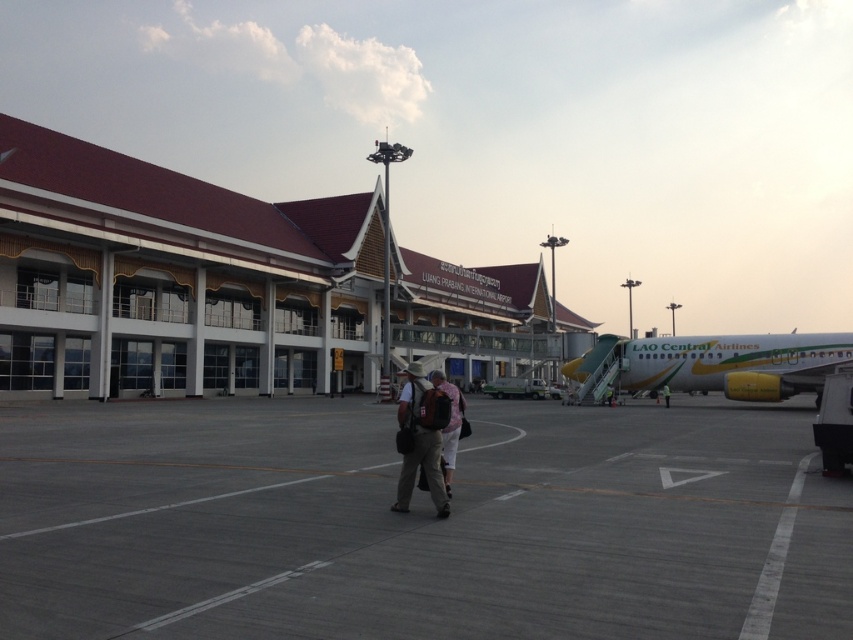
Can you confirm if green/yellow painted airplane at right is thinner than brown fabric backpack at center?

In fact, green/yellow painted airplane at right might be wider than brown fabric backpack at center.

Between green/yellow painted airplane at right and brown fabric backpack at center, which one has more height?

green/yellow painted airplane at right is taller.

Where is `green/yellow painted airplane at right`? green/yellow painted airplane at right is located at coordinates (720, 364).

Is point (349, 582) farther from camera compared to point (454, 388)?

No, it is not.

Is gray asphalt tarmac at center thinner than matte black backpack at center?

In fact, gray asphalt tarmac at center might be wider than matte black backpack at center.

Which is behind, point (502, 573) or point (444, 470)?

The point (444, 470) is more distant.

I want to click on gray asphalt tarmac at center, so click(x=418, y=524).

Which is more to the left, gray asphalt tarmac at center or dark blue uniform at center?

Positioned to the left is gray asphalt tarmac at center.

Does gray asphalt tarmac at center appear on the right side of dark blue uniform at center?

No, gray asphalt tarmac at center is not to the right of dark blue uniform at center.

Does point (285, 433) lie in front of point (666, 400)?

Yes.

The image size is (853, 640). I want to click on gray asphalt tarmac at center, so click(418, 524).